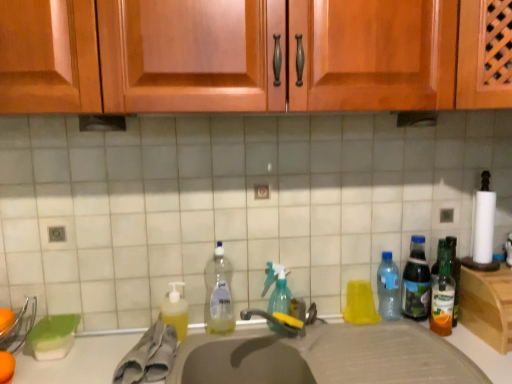
The image size is (512, 384). What do you see at coordinates (487, 305) in the screenshot?
I see `green glass bottle at right` at bounding box center [487, 305].

How much space does translucent plastic spray bottle at center, the fourth bottle viewed from the right, occupy horizontally?

5.83 centimeters.

What is the approximate width of translucent plastic bottle at right, which is the 5th bottle from left to right?

It is 2.69 inches.

The height and width of the screenshot is (384, 512). I want to click on white tile at center, so click(x=232, y=204).

Is the surface of translucent plastic spray bottle at center, the fourth bottle viewed from the right, in direct contact with gray matte sink at center?

No, translucent plastic spray bottle at center, the fourth bottle viewed from the right, is not making contact with gray matte sink at center.

Does translucent plastic spray bottle at center, the fourth bottle viewed from the right, have a greater height compared to gray matte sink at center?

In fact, translucent plastic spray bottle at center, the fourth bottle viewed from the right, may be shorter than gray matte sink at center.

Is translucent plastic spray bottle at center, the fourth bottle viewed from the right, inside the boundaries of gray matte sink at center, or outside?

translucent plastic spray bottle at center, the fourth bottle viewed from the right, is not enclosed by gray matte sink at center.

Is yellow translucent liquid at sink left aimed at gray fabric towel at sink?

Yes, yellow translucent liquid at sink left faces towards gray fabric towel at sink.

Consider the image. Looking at the image, does yellow translucent liquid at sink left seem bigger or smaller compared to gray fabric towel at sink?

Clearly, yellow translucent liquid at sink left is smaller in size than gray fabric towel at sink.

Looking at this image, between yellow translucent liquid at sink left and gray fabric towel at sink, which one is positioned behind?

yellow translucent liquid at sink left is further from the camera.

Considering the relative sizes of yellow translucent liquid at sink left and gray fabric towel at sink in the image provided, is yellow translucent liquid at sink left shorter than gray fabric towel at sink?

No.

Which is more to the right, translucent plastic spray bottle at center, the 2th bottle viewed from the left, or gray fabric towel at sink?

From the viewer's perspective, translucent plastic spray bottle at center, the 2th bottle viewed from the left, appears more on the right side.

Is translucent plastic spray bottle at center, the fourth bottle viewed from the right, not inside gray fabric towel at sink?

Yes, translucent plastic spray bottle at center, the fourth bottle viewed from the right, is outside of gray fabric towel at sink.

Is point (281, 297) closer to viewer compared to point (163, 325)?

That is False.

From a real-world perspective, is translucent plastic spray bottle at center, the 2th bottle viewed from the left, positioned above or below gray fabric towel at sink?

From a real-world perspective, translucent plastic spray bottle at center, the 2th bottle viewed from the left, is physically above gray fabric towel at sink.

Between white tile at center and translucent plastic bottle at right, which is the 5th bottle from left to right, which one has less height?

Standing shorter between the two is translucent plastic bottle at right, which is the 5th bottle from left to right.

Is white tile at center next to translucent plastic bottle at right, which is the first bottle from right to left?

No, white tile at center is not with translucent plastic bottle at right, which is the first bottle from right to left.

Is white tile at center positioned behind translucent plastic bottle at right, which is the first bottle from right to left?

No.

How many degrees apart are the facing directions of white tile at center and translucent plastic bottle at right, which is the 5th bottle from left to right?

0.0989 degrees separate the facing orientations of white tile at center and translucent plastic bottle at right, which is the 5th bottle from left to right.

Does clear plastic bottle at center, placed as the 5th bottle when sorted from right to left, have a greater height compared to gray fabric towel at sink?

Indeed, clear plastic bottle at center, placed as the 5th bottle when sorted from right to left, has a greater height compared to gray fabric towel at sink.

Would you say clear plastic bottle at center, the first bottle from the left, contains gray fabric towel at sink?

No, gray fabric towel at sink is not a part of clear plastic bottle at center, the first bottle from the left.

Which object is positioned more to the right, clear plastic bottle at center, the first bottle from the left, or gray fabric towel at sink?

Positioned to the right is clear plastic bottle at center, the first bottle from the left.

Is the surface of clear plastic bottle at center, the first bottle from the left, in direct contact with gray fabric towel at sink?

No, clear plastic bottle at center, the first bottle from the left, is not in contact with gray fabric towel at sink.

Which of these two, translucent plastic bottle at right, the second bottle when ordered from right to left, or translucent plastic bottle at right, which is the first bottle from right to left, is smaller?

With smaller size is translucent plastic bottle at right, which is the first bottle from right to left.

From the image's perspective, would you say translucent plastic bottle at right, the second bottle when ordered from right to left, is shown under translucent plastic bottle at right, which is the 5th bottle from left to right?

No, from the image's perspective, translucent plastic bottle at right, the second bottle when ordered from right to left, is not below translucent plastic bottle at right, which is the 5th bottle from left to right.

In terms of width, does translucent plastic bottle at right, the fourth bottle viewed from the left, look wider or thinner when compared to translucent plastic bottle at right, which is the 5th bottle from left to right?

In the image, translucent plastic bottle at right, the fourth bottle viewed from the left, appears to be wider than translucent plastic bottle at right, which is the 5th bottle from left to right.

Is translucent plastic bottle at right, which is the first bottle from right to left, at the back of translucent plastic bottle at right, the fourth bottle viewed from the left?

That's not correct — translucent plastic bottle at right, the fourth bottle viewed from the left, is not looking away from translucent plastic bottle at right, which is the first bottle from right to left.

Which is behind, point (447, 276) or point (220, 362)?

The point (447, 276) is farther.

Where is `the 3rd bottle counting from the right of the gray matte sink at center`? the 3rd bottle counting from the right of the gray matte sink at center is located at coordinates (443, 296).

Considering the sizes of translucent plastic bottle at right, which is the first bottle from right to left, and gray matte sink at center in the image, is translucent plastic bottle at right, which is the first bottle from right to left, bigger or smaller than gray matte sink at center?

In the image, translucent plastic bottle at right, which is the first bottle from right to left, appears to be smaller than gray matte sink at center.

Does translucent plastic bottle at right, which is the first bottle from right to left, have a greater width compared to gray matte sink at center?

No.

In the image, there is a translucent plastic spray bottle at center, the fourth bottle viewed from the right. In order to click on sink below it (from the image's perspective) in this screenshot , I will do `click(325, 357)`.

You are a GUI agent. You are given a task and a screenshot of the screen. Output one action in this format:
    pyautogui.click(x=<x>, y=<y>)
    Task: Click on the cleaning product to the right of gray fabric towel at sink
    This screenshot has height=384, width=512.
    Given the screenshot: What is the action you would take?
    pyautogui.click(x=175, y=310)

Estimate the real-world distances between objects in this image. Which object is further from gray matte sink at center, white tile at center or green glass bottle at right?

white tile at center.

Considering their positions, is translucent plastic bottle at right, the second bottle when ordered from right to left, positioned closer to clear plastic bottle at center, the first bottle from the left, than translucent plastic bottle at right, which is the 5th bottle from left to right?

Among the two, translucent plastic bottle at right, the second bottle when ordered from right to left, is located nearer to clear plastic bottle at center, the first bottle from the left.

Looking at the image, which one is located further to white tile at center, translucent plastic bottle at right, which is the first bottle from right to left, or translucent plastic bottle at right, the second bottle when ordered from right to left?

Based on the image, translucent plastic bottle at right, which is the first bottle from right to left, appears to be further to white tile at center.

From the image, which object appears to be farther from white tile at center, gray matte sink at center or gray fabric towel at sink?

gray fabric towel at sink.

Based on their spatial positions, is gray matte sink at center or translucent plastic bottle at right, which is the 5th bottle from left to right, closer to yellow translucent liquid at sink left?

gray matte sink at center lies closer to yellow translucent liquid at sink left than the other object.

When comparing their distances from translucent plastic bottle at right, which is the first bottle from right to left, does yellow translucent liquid at sink left or green glass bottle at right seem further?

Among the two, yellow translucent liquid at sink left is located further to translucent plastic bottle at right, which is the first bottle from right to left.

Estimate the real-world distances between objects in this image. Which object is closer to gray fabric towel at sink, translucent plastic bottle at right, the fourth bottle viewed from the left, or green glass bottle at right?

translucent plastic bottle at right, the fourth bottle viewed from the left, lies closer to gray fabric towel at sink than the other object.

Based on their spatial positions, is translucent plastic bottle at right, the fourth bottle viewed from the left, or yellow translucent liquid at sink left further from translucent plastic spray bottle at center, the fourth bottle viewed from the right?

translucent plastic bottle at right, the fourth bottle viewed from the left, is further to translucent plastic spray bottle at center, the fourth bottle viewed from the right.

Image resolution: width=512 pixels, height=384 pixels. Find the location of `cleaning product between gray fabric towel at sink and translucent plastic bottle at right, which is the 5th bottle from left to right, from left to right`. cleaning product between gray fabric towel at sink and translucent plastic bottle at right, which is the 5th bottle from left to right, from left to right is located at coordinates (175, 310).

I want to click on cleaning product located between gray fabric towel at sink and translucent plastic bottle at right, the fourth bottle viewed from the left, in the left-right direction, so click(x=175, y=310).

You are a GUI agent. You are given a task and a screenshot of the screen. Output one action in this format:
    pyautogui.click(x=<x>, y=<y>)
    Task: Click on the tile situated between gray fabric towel at sink and green glass bottle at right from left to right
    The width and height of the screenshot is (512, 384).
    Given the screenshot: What is the action you would take?
    pyautogui.click(x=232, y=204)

Locate an element on the screen. sink between gray fabric towel at sink and green glass bottle at right from left to right is located at coordinates (325, 357).